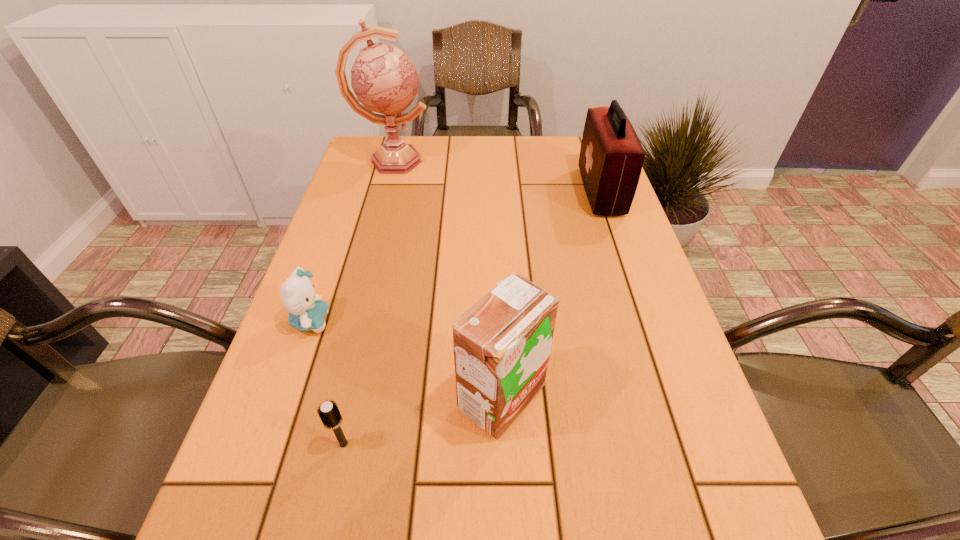
At what (x,y) coordinates should I click in order to perform the action: click on object that is at the far left corner. Please return your answer as a coordinate pair (x, y). Image resolution: width=960 pixels, height=540 pixels. Looking at the image, I should click on (383, 78).

Locate an element on the screen. This screenshot has width=960, height=540. object that is at the far right corner is located at coordinates (611, 157).

Locate an element on the screen. blank area at the far edge is located at coordinates (528, 151).

Where is `free spot at the left edge of the desktop`? The height and width of the screenshot is (540, 960). free spot at the left edge of the desktop is located at coordinates (252, 467).

At what (x,y) coordinates should I click in order to perform the action: click on free point at the right edge. Please return your answer as a coordinate pair (x, y). This screenshot has width=960, height=540. Looking at the image, I should click on (607, 230).

The width and height of the screenshot is (960, 540). I want to click on free space at the far left corner, so click(373, 173).

Identify the location of free space between the globe and the kitten. (352, 241).

Locate an element on the screen. The width and height of the screenshot is (960, 540). free space between the rightmost object and the globe is located at coordinates (497, 177).

This screenshot has width=960, height=540. I want to click on vacant area that lies between the third nearest object and the globe, so click(352, 241).

Find the location of `vacant region between the tallest object and the first aid kit`. vacant region between the tallest object and the first aid kit is located at coordinates (497, 177).